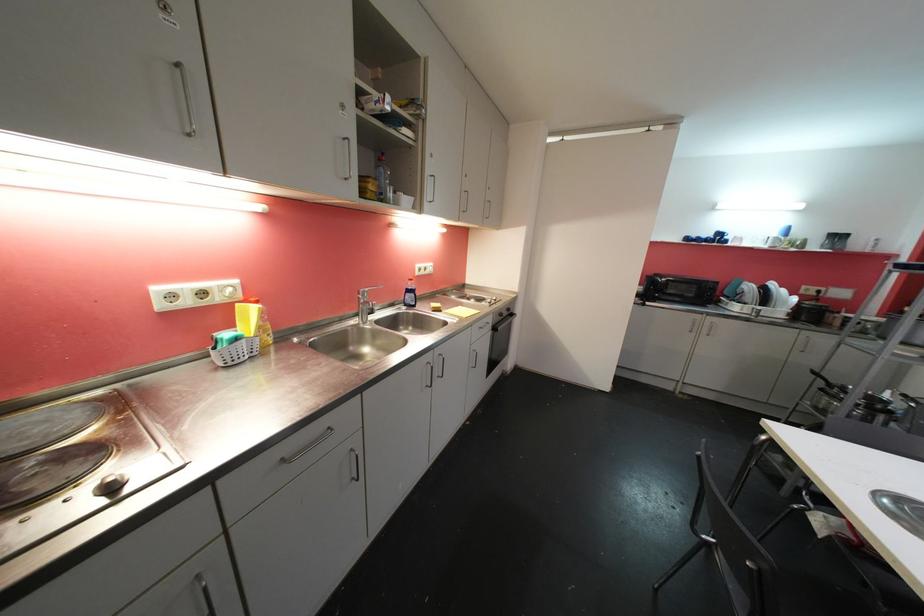
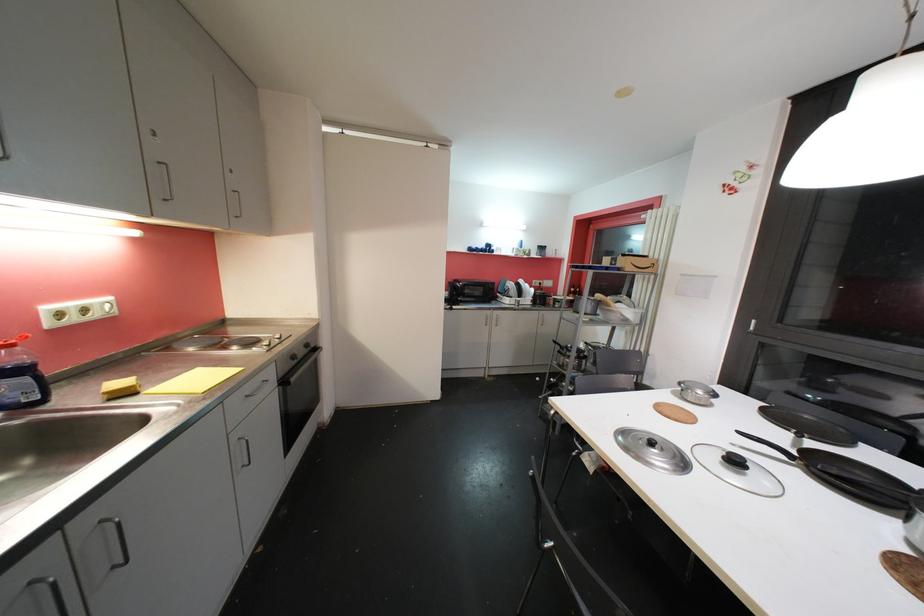
Question: The camera is either moving clockwise (left) or counter-clockwise (right) around the object. The first image is from the beginning of the video and the second image is from the end. Is the camera moving left or right when shooting the video?

Choices:
 (A) Left
 (B) Right

Answer: (A)